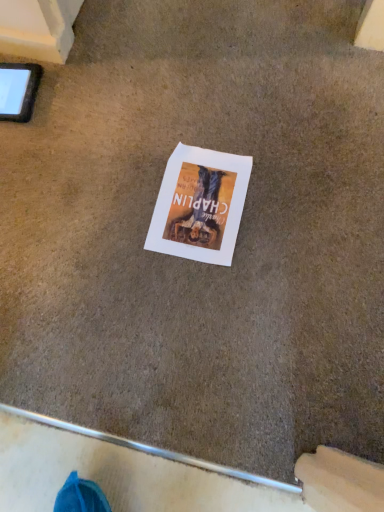
Locate an element on the screen. unoccupied area in front of white paper at center is located at coordinates (198, 302).